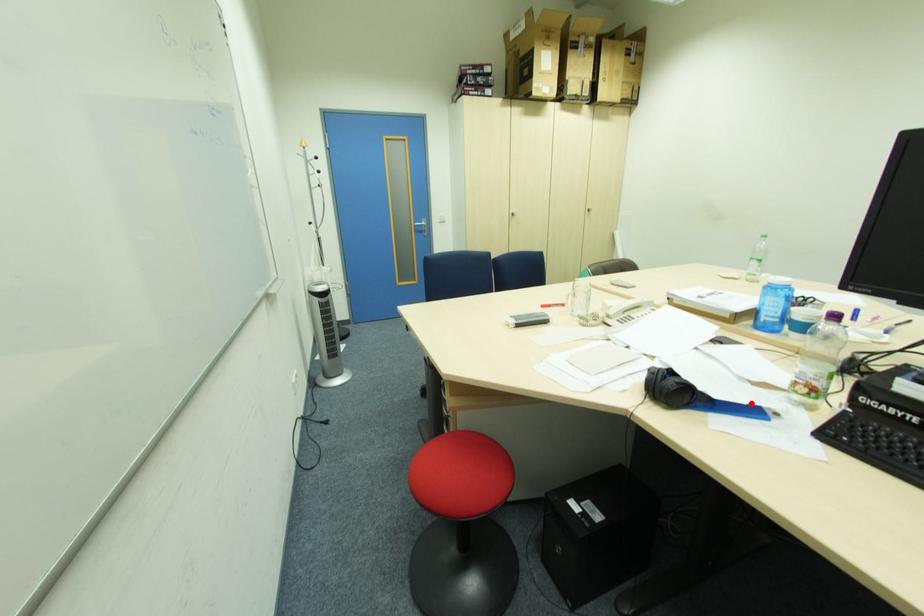
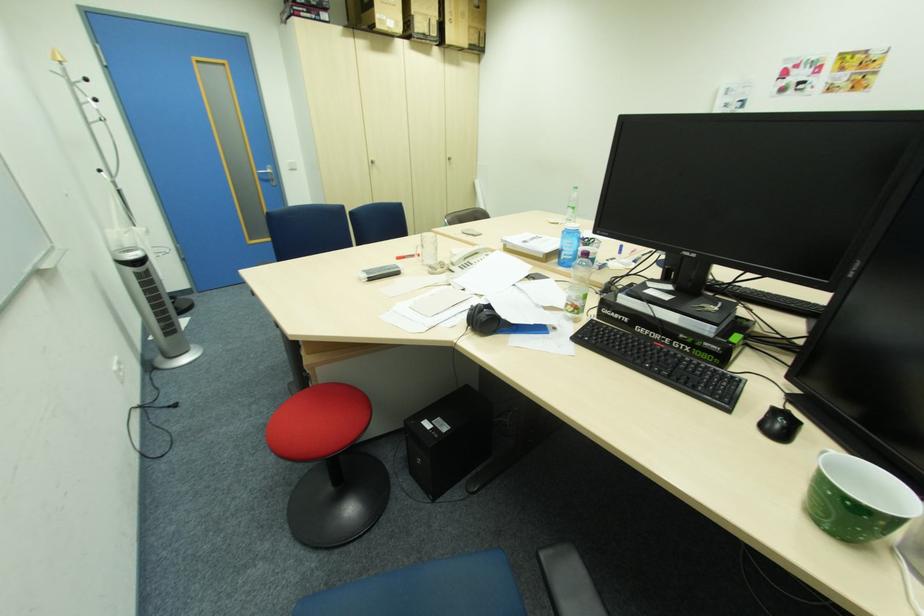
Where in the second image is the point corresponding to the highlighted location from the first image?

(538, 323)